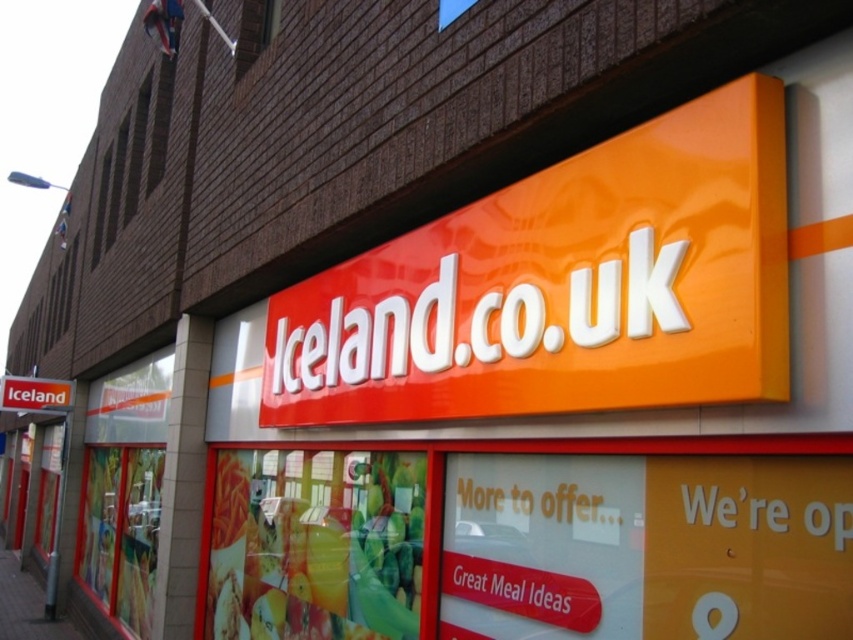
In the scene shown: You are standing in front of the Iceland store. There is a point at coordinates (563, 285). What object is located at that point?

The point at coordinates (563, 285) corresponds to the orange glossy sign at upper center.

You are a delivery driver standing 5 meters away from the Iceland store. You need to deliver a package to the orange glossy sign at upper center. Can you reach it without moving past the orange glossy sign at center?

The orange glossy sign at upper center is 10.86 meters away from the orange glossy sign at center. Since you are already 5 meters away from the store, you would need to move an additional 10.86 meters past the orange glossy sign at center to reach the orange glossy sign at upper center. Therefore, you cannot reach it without moving past the orange glossy sign at center.

You are a delivery driver who needs to park your vehicle near the Iceland store. The parking spot you found has limited space. Given the smooth concrete pavement at lower left and the orange glossy sign at center, which area would allow your vehicle to park without overlapping any objects?

The smooth concrete pavement at lower left is bigger than the orange glossy sign at center, so the vehicle can park on the smooth concrete pavement at lower left without overlapping any objects.